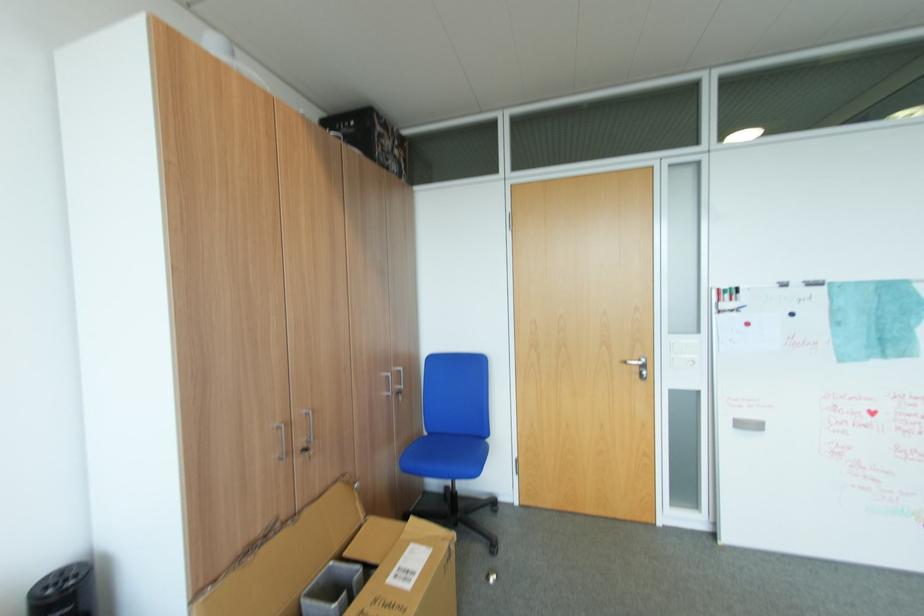
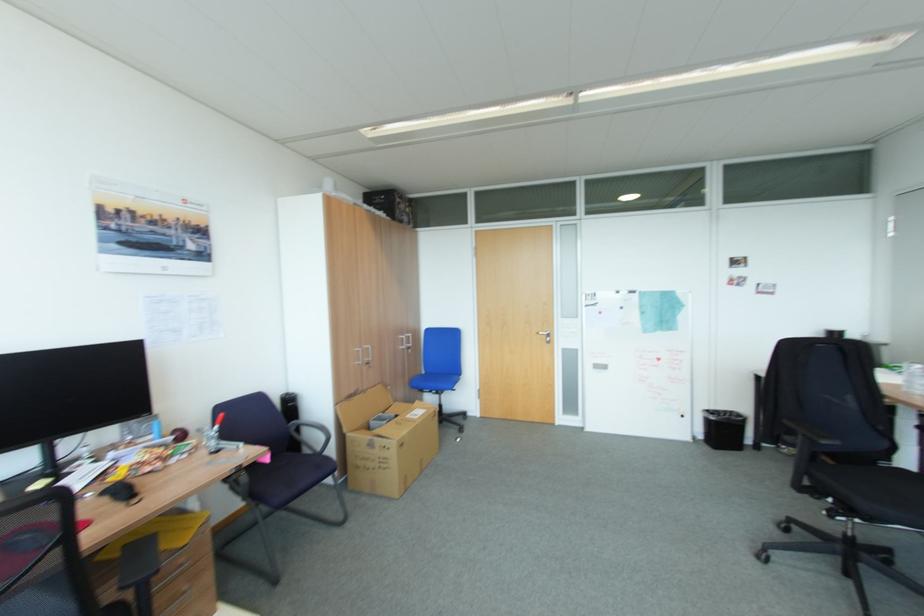
The point at (305, 445) is marked in the first image. Where is the corresponding point in the second image?

(371, 360)